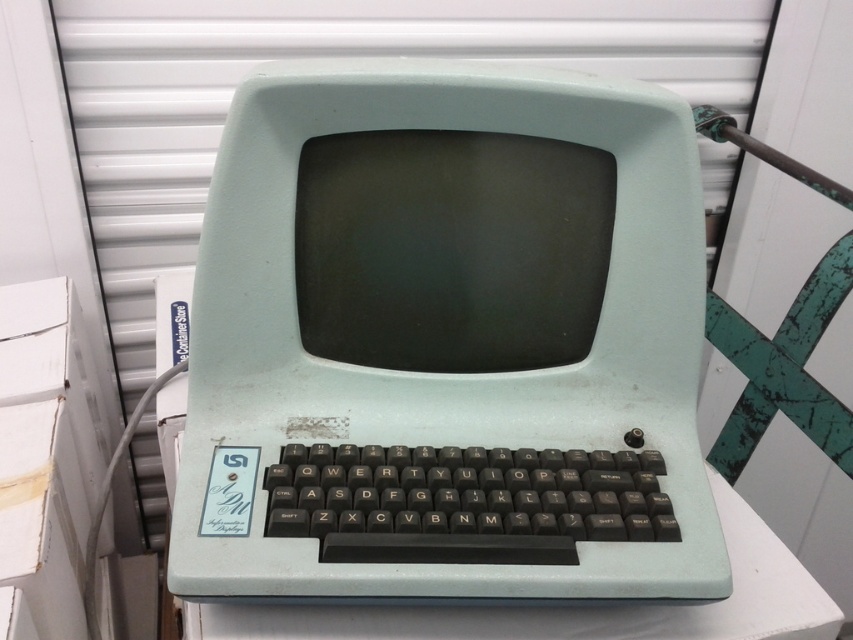
Which is more to the right, matte plastic computer at center or white plastic keyboard at center?

white plastic keyboard at center

Is matte plastic computer at center to the right of white plastic keyboard at center from the viewer's perspective?

In fact, matte plastic computer at center is to the left of white plastic keyboard at center.

Find the location of a particular element. This screenshot has height=640, width=853. matte plastic computer at center is located at coordinates (447, 342).